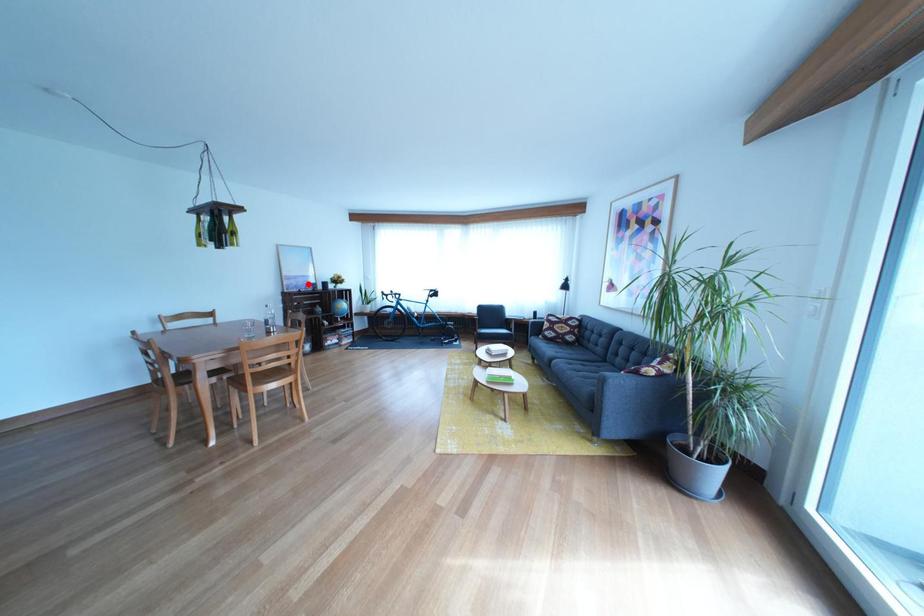
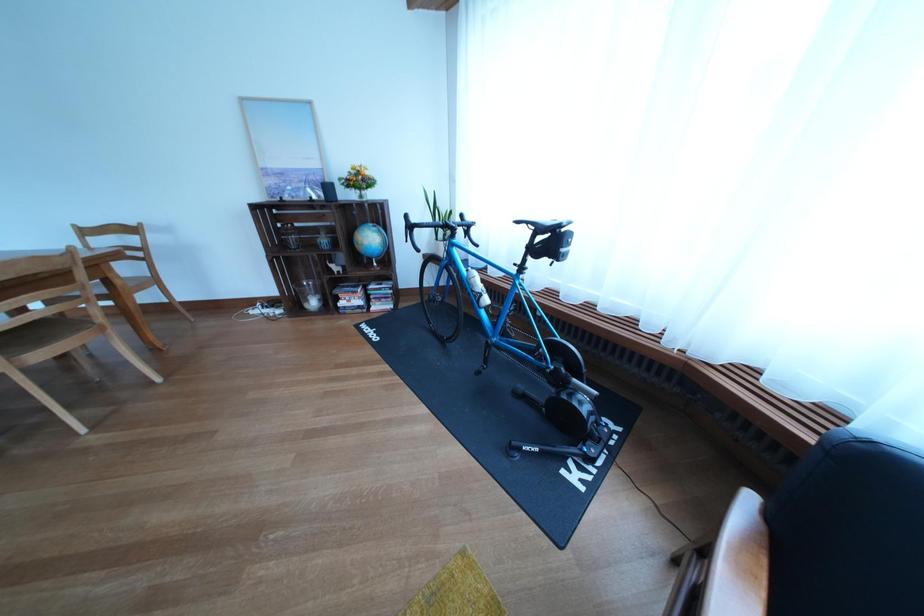
Locate, in the second image, the point that corresponds to the highlighted location in the first image.

(294, 179)